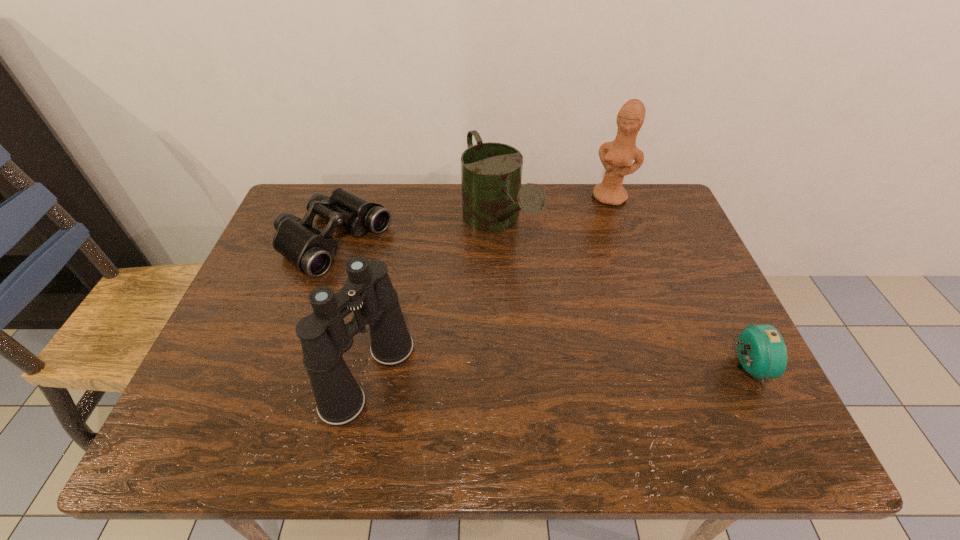
Identify the location of free space on the desktop that is between the taller binoculars and the alarm clock and is positioned with the spout on the third shortest object. The width and height of the screenshot is (960, 540). (603, 370).

Locate an element on the screen. free spot on the desktop that is between the taller binoculars and the alarm clock and is positioned on the front-facing side of the figurine is located at coordinates (522, 373).

Identify the location of free space on the desktop that is between the taller binoculars and the alarm clock and is positioned on the front-facing side of the shorter binoculars. (549, 372).